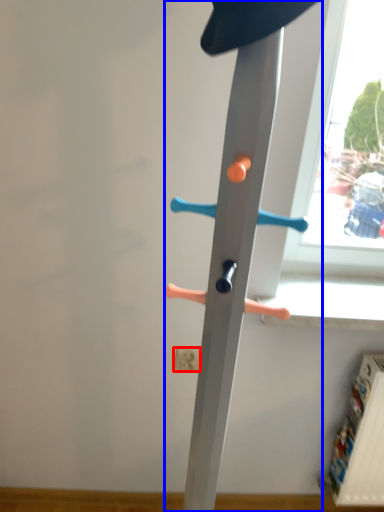
Question: Which object appears closest to the camera in this image, electric outlet (highlighted by a red box) or furniture (highlighted by a blue box)?

Choices:
 (A) electric outlet
 (B) furniture

Answer: (B)